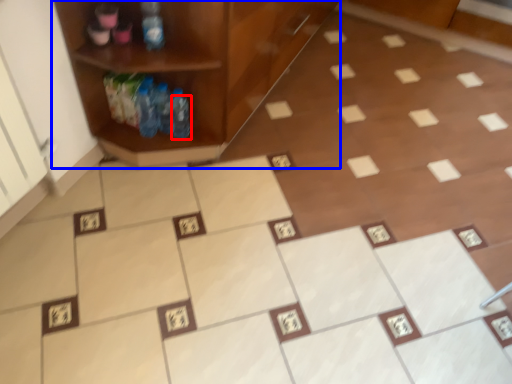
Question: Among these objects, which one is nearest to the camera, bottle (highlighted by a red box) or shelf (highlighted by a blue box)?

Choices:
 (A) bottle
 (B) shelf

Answer: (B)